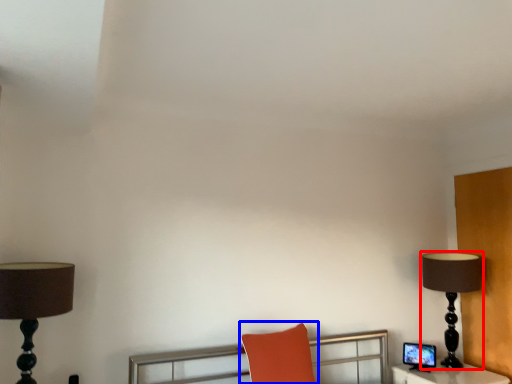
Question: Among these objects, which one is farthest to the camera, lamp (highlighted by a red box) or swivel chair (highlighted by a blue box)?

Choices:
 (A) lamp
 (B) swivel chair

Answer: (A)